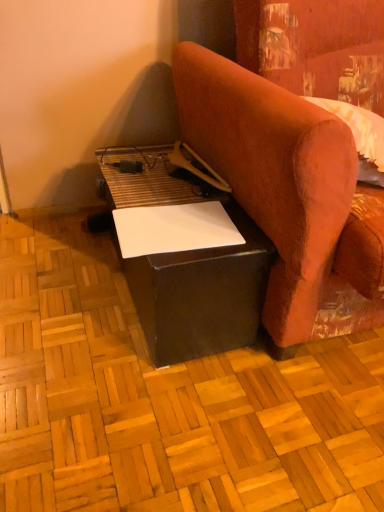
At what (x,y) coordinates should I click in order to perform the action: click on black matte table at lower center. Please return your answer as a coordinate pair (x, y). Looking at the image, I should click on (189, 264).

Describe the element at coordinates (189, 264) in the screenshot. This screenshot has width=384, height=512. I see `black matte table at lower center` at that location.

The width and height of the screenshot is (384, 512). What do you see at coordinates (167, 400) in the screenshot? I see `matte black plywood at center` at bounding box center [167, 400].

Describe the element at coordinates (289, 195) in the screenshot. I see `velvet-like orange armchair at right` at that location.

You are a GUI agent. You are given a task and a screenshot of the screen. Output one action in this format:
    pyautogui.click(x=<x>, y=<y>)
    Task: Click on the black matte table at lower center
    
    Given the screenshot: What is the action you would take?
    pyautogui.click(x=189, y=264)

Which object is positioned more to the left, black matte table at lower center or matte black plywood at center?

From the viewer's perspective, black matte table at lower center appears more on the left side.

Based on their sizes in the image, would you say black matte table at lower center is bigger or smaller than matte black plywood at center?

black matte table at lower center is bigger than matte black plywood at center.

Which object is further away from the camera taking this photo, black matte table at lower center or matte black plywood at center?

Positioned behind is black matte table at lower center.

From the image's perspective, is black matte table at lower center located above matte black plywood at center?

Correct, black matte table at lower center appears higher than matte black plywood at center in the image.

Is velvet-like orange armchair at right taller than black matte table at lower center?

Indeed, velvet-like orange armchair at right has a greater height compared to black matte table at lower center.

From the image's perspective, is velvet-like orange armchair at right above black matte table at lower center?

Yes, from the image's perspective, velvet-like orange armchair at right is on top of black matte table at lower center.

Which is correct: velvet-like orange armchair at right is inside black matte table at lower center, or outside of it?

velvet-like orange armchair at right is not inside black matte table at lower center, it's outside.

Visually, is velvet-like orange armchair at right positioned to the left or to the right of matte black plywood at center?

velvet-like orange armchair at right is positioned on matte black plywood at center's right side.

Is velvet-like orange armchair at right positioned far away from matte black plywood at center?

They are positioned close to each other.

Considering the sizes of velvet-like orange armchair at right and matte black plywood at center in the image, is velvet-like orange armchair at right bigger or smaller than matte black plywood at center?

Considering their sizes, velvet-like orange armchair at right takes up more space than matte black plywood at center.

Between velvet-like orange armchair at right and matte black plywood at center, which one has smaller width?

Thinner between the two is velvet-like orange armchair at right.

From the image's perspective, relative to white paper at lower center, is velvet-like orange armchair at right above or below?

Based on their image positions, velvet-like orange armchair at right is located above white paper at lower center.

Which object is closer to the camera, velvet-like orange armchair at right or white paper at lower center?

velvet-like orange armchair at right is closer to the camera.

Consider the image. Would you consider velvet-like orange armchair at right to be distant from white paper at lower center?

No, there isn't a large distance between velvet-like orange armchair at right and white paper at lower center.

Are black matte table at lower center and velvet-like orange armchair at right located far from each other?

Actually, black matte table at lower center and velvet-like orange armchair at right are a little close together.

In the scene shown: Between black matte table at lower center and velvet-like orange armchair at right, which one has larger width?

velvet-like orange armchair at right.

Is the depth of black matte table at lower center greater than that of velvet-like orange armchair at right?

Yes, black matte table at lower center is further from the viewer.

How distant is black matte table at lower center from velvet-like orange armchair at right?

black matte table at lower center and velvet-like orange armchair at right are 7.29 inches apart.

In the scene shown: Is matte black plywood at center situated inside velvet-like orange armchair at right or outside?

matte black plywood at center is not enclosed by velvet-like orange armchair at right.

Is velvet-like orange armchair at right at the back of matte black plywood at center?

That's not correct — matte black plywood at center is not looking away from velvet-like orange armchair at right.

Based on the photo, from a real-world perspective, is matte black plywood at center positioned under velvet-like orange armchair at right based on gravity?

Yes, from a real-world perspective, matte black plywood at center is under velvet-like orange armchair at right.

Find the location of a particular element. The width and height of the screenshot is (384, 512). notepad on the right of black matte table at lower center is located at coordinates (174, 229).

Can we say black matte table at lower center lies outside white paper at lower center?

Yes, black matte table at lower center is outside of white paper at lower center.

Based on their positions, is black matte table at lower center located to the left or right of white paper at lower center?

Based on their positions, black matte table at lower center is located to the left of white paper at lower center.

You are a GUI agent. You are given a task and a screenshot of the screen. Output one action in this format:
    pyautogui.click(x=<x>, y=<y>)
    Task: Click on the plywood in front of the black matte table at lower center
    
    Given the screenshot: What is the action you would take?
    click(x=167, y=400)

This screenshot has height=512, width=384. I want to click on table on the left of the velvet-like orange armchair at right, so click(x=189, y=264).

Estimate the real-world distances between objects in this image. Which object is closer to white paper at lower center, matte black plywood at center or velvet-like orange armchair at right?

velvet-like orange armchair at right is closer to white paper at lower center.

Considering their positions, is velvet-like orange armchair at right positioned further to black matte table at lower center than matte black plywood at center?

Based on the image, matte black plywood at center appears to be further to black matte table at lower center.

From the image, which object appears to be nearer to matte black plywood at center, black matte table at lower center or white paper at lower center?

black matte table at lower center is positioned closer to the anchor matte black plywood at center.

When comparing their distances from white paper at lower center, does black matte table at lower center or matte black plywood at center seem closer?

The object closer to white paper at lower center is black matte table at lower center.

From the image, which object appears to be nearer to matte black plywood at center, white paper at lower center or black matte table at lower center?

black matte table at lower center lies closer to matte black plywood at center than the other object.

Looking at the image, which one is located closer to white paper at lower center, matte black plywood at center or black matte table at lower center?

black matte table at lower center is positioned closer to the anchor white paper at lower center.

Based on their spatial positions, is velvet-like orange armchair at right or matte black plywood at center closer to white paper at lower center?

Based on the image, velvet-like orange armchair at right appears to be nearer to white paper at lower center.

Estimate the real-world distances between objects in this image. Which object is closer to velvet-like orange armchair at right, white paper at lower center or matte black plywood at center?

Based on the image, white paper at lower center appears to be nearer to velvet-like orange armchair at right.

Find the location of `plywood between white paper at lower center and velvet-like orange armchair at right in the horizontal direction`. plywood between white paper at lower center and velvet-like orange armchair at right in the horizontal direction is located at coordinates pos(167,400).

The height and width of the screenshot is (512, 384). Identify the location of table between matte black plywood at center and white paper at lower center in the front-back direction. (189, 264).

I want to click on plywood located between black matte table at lower center and velvet-like orange armchair at right in the left-right direction, so click(x=167, y=400).

This screenshot has width=384, height=512. What are the coordinates of `notepad located between black matte table at lower center and velvet-like orange armchair at right in the left-right direction` in the screenshot? It's located at (174, 229).